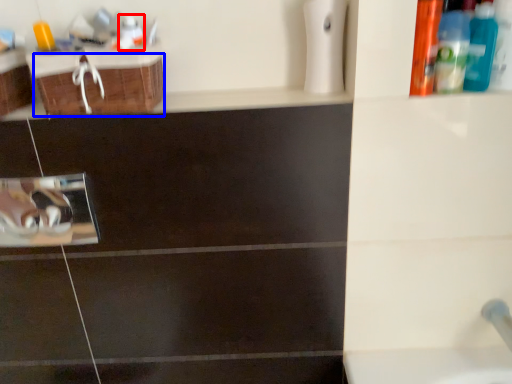
Question: Which object is closer to the camera taking this photo, mouthwash (highlighted by a red box) or drawer (highlighted by a blue box)?

Choices:
 (A) mouthwash
 (B) drawer

Answer: (B)